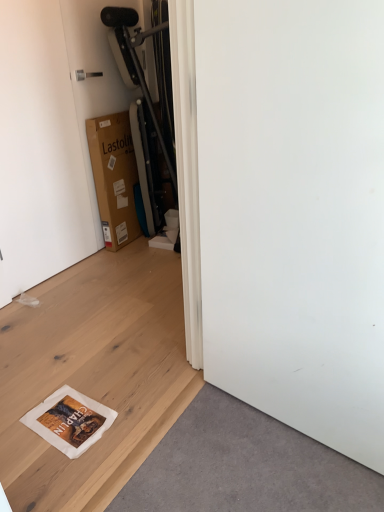
Question: From the image's perspective, is white matte door at upper left below white matte screen door at lower right?

Choices:
 (A) yes
 (B) no

Answer: (B)

Question: Can you confirm if white matte door at upper left is shorter than white matte screen door at lower right?

Choices:
 (A) no
 (B) yes

Answer: (A)

Question: From a real-world perspective, is white matte door at upper left on top of white matte screen door at lower right?

Choices:
 (A) yes
 (B) no

Answer: (A)

Question: Does white matte door at upper left have a smaller size compared to white matte screen door at lower right?

Choices:
 (A) yes
 (B) no

Answer: (A)

Question: Are white matte door at upper left and white matte screen door at lower right beside each other?

Choices:
 (A) yes
 (B) no

Answer: (B)

Question: Is point (150, 314) closer or farther from the camera than point (249, 123)?

Choices:
 (A) closer
 (B) farther

Answer: (B)

Question: Is white matte plywood at lower left taller or shorter than white matte screen door at lower right?

Choices:
 (A) tall
 (B) short

Answer: (B)

Question: Is white matte plywood at lower left in front of or behind white matte screen door at lower right in the image?

Choices:
 (A) front
 (B) behind

Answer: (B)

Question: Is white matte plywood at lower left to the left or to the right of white matte screen door at lower right in the image?

Choices:
 (A) right
 (B) left

Answer: (B)

Question: In the image, is white matte door at upper left on the left side or the right side of white matte screen door at lower right?

Choices:
 (A) left
 (B) right

Answer: (A)

Question: From the image's perspective, is white matte door at upper left above or below white matte screen door at lower right?

Choices:
 (A) below
 (B) above

Answer: (B)

Question: From a real-world perspective, is white matte door at upper left physically located above or below white matte screen door at lower right?

Choices:
 (A) below
 (B) above

Answer: (B)

Question: Relative to white matte screen door at lower right, is white matte door at upper left in front or behind?

Choices:
 (A) behind
 (B) front

Answer: (A)

Question: From the image's perspective, is white matte plywood at lower left positioned above or below white matte door at upper left?

Choices:
 (A) below
 (B) above

Answer: (A)

Question: Considering the positions of white matte plywood at lower left and white matte door at upper left in the image, is white matte plywood at lower left taller or shorter than white matte door at upper left?

Choices:
 (A) short
 (B) tall

Answer: (A)